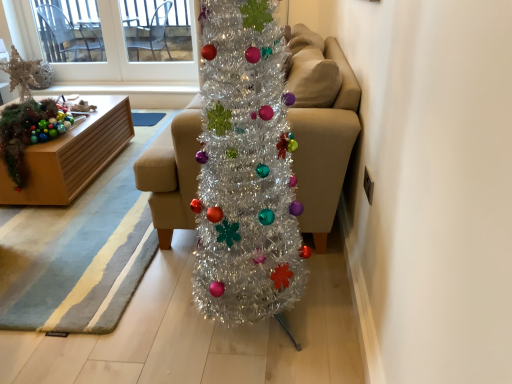
You are a GUI agent. You are given a task and a screenshot of the screen. Output one action in this format:
    pyautogui.click(x=<x>, y=<y>)
    Task: Click on the beige fabric couch at center
    This screenshot has height=384, width=512.
    Given the screenshot: What is the action you would take?
    point(321,126)

This screenshot has height=384, width=512. What do you see at coordinates (29, 132) in the screenshot?
I see `shiny metallic garland at left` at bounding box center [29, 132].

This screenshot has height=384, width=512. I want to click on wooden box at left, so click(72, 156).

At what (x,y) coordinates should I click in order to perform the action: click on beige fabric couch at center. Please return your answer as a coordinate pair (x, y). Looking at the image, I should click on (321, 126).

This screenshot has width=512, height=384. I want to click on furniture that appears above the shiny metallic garland at left (from the image's perspective), so click(x=72, y=156).

Looking at this image, considering the positions of objects shiny metallic garland at left and wooden box at left in the image provided, who is behind, shiny metallic garland at left or wooden box at left?

Positioned behind is wooden box at left.

Considering the sizes of objects shiny metallic garland at left and wooden box at left in the image provided, who is taller, shiny metallic garland at left or wooden box at left?

With more height is shiny metallic garland at left.

How much distance is there between shiny metallic garland at left and wooden box at left?

They are 7.75 inches apart.

Measure the distance from beige fabric couch at center to wooden box at left.

beige fabric couch at center and wooden box at left are 4.45 feet apart.

Consider the image. Which is closer, (304, 62) or (106, 105)?

Point (304, 62) is closer to the camera than point (106, 105).

Is beige fabric couch at center positioned in front of wooden box at left?

Yes, beige fabric couch at center is closer to the camera.

Considering the sizes of objects white plastic window screen at upper left and shiny metallic garland at left in the image provided, who is thinner, white plastic window screen at upper left or shiny metallic garland at left?

With smaller width is white plastic window screen at upper left.

From their relative heights in the image, would you say white plastic window screen at upper left is taller or shorter than shiny metallic garland at left?

Considering their sizes, white plastic window screen at upper left has more height than shiny metallic garland at left.

Can you confirm if white plastic window screen at upper left is positioned to the right of shiny metallic garland at left?

Incorrect, white plastic window screen at upper left is not on the right side of shiny metallic garland at left.

Between shiny metallic garland at left and white plastic window screen at upper left, which one has larger width?

shiny metallic garland at left is wider.

Between point (20, 110) and point (63, 79), which one is positioned behind?

The point (63, 79) is farther.

How many degrees apart are the facing directions of shiny metallic garland at left and white plastic window screen at upper left?

The facing directions of shiny metallic garland at left and white plastic window screen at upper left are 93.8 degrees apart.

Considering the sizes of shiny metallic garland at left and white plastic window screen at upper left in the image, is shiny metallic garland at left taller or shorter than white plastic window screen at upper left?

shiny metallic garland at left is shorter than white plastic window screen at upper left.

Between white plastic window screen at upper left and wooden box at left, which one has larger width?

wooden box at left is wider.

There is a wooden box at left. Where is `window screen above it (from a real-world perspective)`? window screen above it (from a real-world perspective) is located at coordinates (127, 58).

Does point (74, 66) come closer to viewer compared to point (127, 129)?

No, (74, 66) is further to viewer.

From the image's perspective, is white plastic window screen at upper left located above or below wooden box at left?

white plastic window screen at upper left is above wooden box at left.

Is point (91, 125) farther from viewer compared to point (342, 62)?

Yes, point (91, 125) is behind point (342, 62).

From the image's perspective, is wooden box at left above or below beige fabric couch at center?

Clearly, from the image's perspective, wooden box at left is below beige fabric couch at center.

Is wooden box at left oriented away from beige fabric couch at center?

No, beige fabric couch at center is not at the back of wooden box at left.

From a real-world perspective, who is located higher, wooden box at left or beige fabric couch at center?

From a 3D spatial view, beige fabric couch at center is above.

Is beige fabric couch at center turned away from shiny metallic garland at left?

No.

Between beige fabric couch at center and shiny metallic garland at left, which one has more height?

beige fabric couch at center.

From the picture: Who is bigger, beige fabric couch at center or shiny metallic garland at left?

beige fabric couch at center.

Find the location of `christmas decoration in front of the wooden box at left`. christmas decoration in front of the wooden box at left is located at coordinates (29, 132).

In the image, there is a beige fabric couch at center. Identify the location of furniture below it (from a real-world perspective). (72, 156).

Which object lies further to the anchor point shiny metallic garland at left, wooden box at left or beige fabric couch at center?

Among the two, beige fabric couch at center is located further to shiny metallic garland at left.

From the image, which object appears to be farther from shiny metallic garland at left, white plastic window screen at upper left or beige fabric couch at center?

white plastic window screen at upper left is further to shiny metallic garland at left.

Based on their spatial positions, is wooden box at left or shiny metallic garland at left closer to white plastic window screen at upper left?

The object closer to white plastic window screen at upper left is wooden box at left.

Which object lies nearer to the anchor point shiny metallic garland at left, white plastic window screen at upper left or wooden box at left?

The object closer to shiny metallic garland at left is wooden box at left.

From the image, which object appears to be nearer to shiny metallic garland at left, beige fabric couch at center or wooden box at left?

wooden box at left.

Estimate the real-world distances between objects in this image. Which object is closer to white plastic window screen at upper left, wooden box at left or beige fabric couch at center?

wooden box at left is closer to white plastic window screen at upper left.

Looking at the image, which one is located further to beige fabric couch at center, wooden box at left or white plastic window screen at upper left?

Among the two, white plastic window screen at upper left is located further to beige fabric couch at center.

Which object lies nearer to the anchor point wooden box at left, shiny metallic garland at left or beige fabric couch at center?

shiny metallic garland at left.

This screenshot has height=384, width=512. I want to click on christmas decoration between beige fabric couch at center and white plastic window screen at upper left along the z-axis, so click(29, 132).

Where is `furniture positioned between beige fabric couch at center and white plastic window screen at upper left from near to far`? The height and width of the screenshot is (384, 512). furniture positioned between beige fabric couch at center and white plastic window screen at upper left from near to far is located at coordinates (72, 156).

You are a GUI agent. You are given a task and a screenshot of the screen. Output one action in this format:
    pyautogui.click(x=<x>, y=<y>)
    Task: Click on the christmas decoration situated between wooden box at left and beige fabric couch at center from left to right
    
    Given the screenshot: What is the action you would take?
    pyautogui.click(x=29, y=132)

Where is `furniture between shiny metallic garland at left and white plastic window screen at upper left from front to back`? The height and width of the screenshot is (384, 512). furniture between shiny metallic garland at left and white plastic window screen at upper left from front to back is located at coordinates click(72, 156).